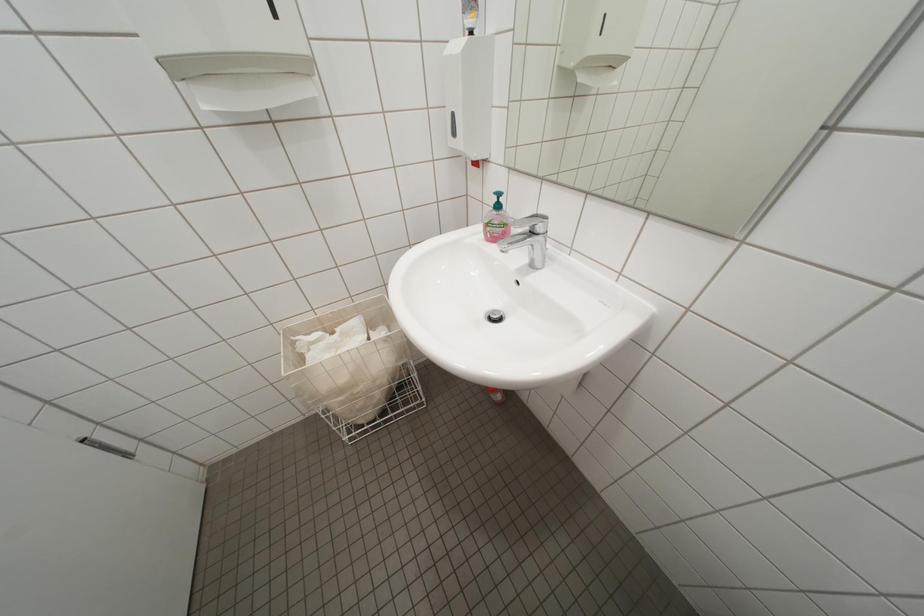
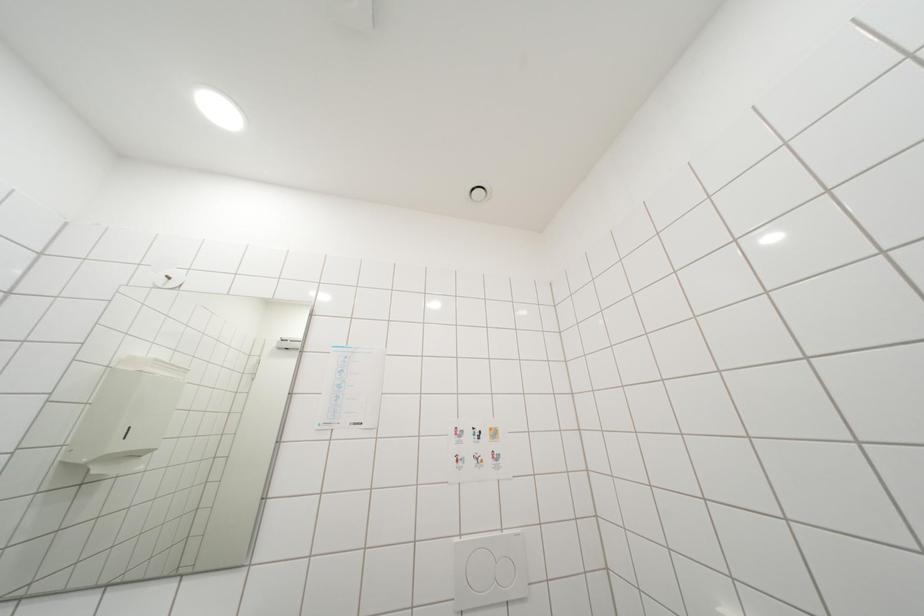
The images are taken continuously from a first-person perspective. In which direction is your viewpoint rotating?

The camera's rotation is toward right-up.